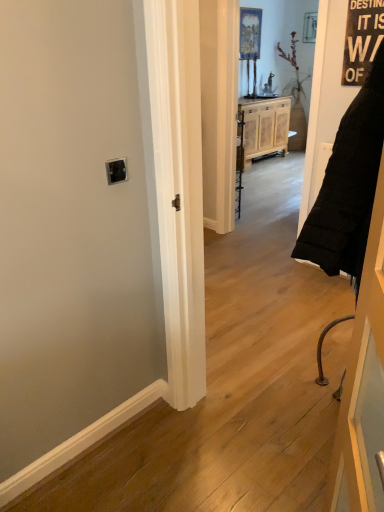
Identify the location of light brown wood cabinet at center. (265, 126).

The image size is (384, 512). Describe the element at coordinates (265, 126) in the screenshot. I see `light brown wood cabinet at center` at that location.

Describe the element at coordinates (363, 386) in the screenshot. I see `black fabric door at right` at that location.

This screenshot has height=512, width=384. I want to click on black fabric door at right, so click(363, 386).

In order to face black fabric door at right, should I rotate leftwards or rightwards?

You should rotate right by 23.812 degrees.

In the scene shown: Measure the distance between point (380, 434) and camera.

The depth of point (380, 434) is 1.07 meters.

You are a GUI agent. You are given a task and a screenshot of the screen. Output one action in this format:
    pyautogui.click(x=<x>, y=<y>)
    Task: Click on the light brown wood cabinet at center
    
    Given the screenshot: What is the action you would take?
    click(265, 126)

Can you confirm if black fabric door at right is positioned to the right of light brown wood cabinet at center?

Incorrect, black fabric door at right is not on the right side of light brown wood cabinet at center.

Is black fabric door at right in front of or behind light brown wood cabinet at center in the image?

Visually, black fabric door at right is located in front of light brown wood cabinet at center.

Is point (354, 406) positioned after point (271, 140)?

No, (354, 406) is closer to viewer.

From the image's perspective, which one is positioned lower, black fabric door at right or light brown wood cabinet at center?

black fabric door at right, from the image's perspective.

From a real-world perspective, which object rests below the other?

From a 3D spatial view, light brown wood cabinet at center is below.

Looking at their sizes, would you say black fabric door at right is wider or thinner than light brown wood cabinet at center?

Considering their sizes, black fabric door at right looks slimmer than light brown wood cabinet at center.

Considering the sizes of black fabric door at right and light brown wood cabinet at center in the image, is black fabric door at right taller or shorter than light brown wood cabinet at center?

black fabric door at right is taller than light brown wood cabinet at center.

Does black fabric door at right have a larger size compared to light brown wood cabinet at center?

No.

Which is correct: black fabric door at right is inside light brown wood cabinet at center, or outside of it?

black fabric door at right lies outside light brown wood cabinet at center.

Is the surface of black fabric door at right in direct contact with light brown wood cabinet at center?

They are not placed beside each other.

Is black fabric door at right looking in the opposite direction of light brown wood cabinet at center?

No.

Consider the image. How many degrees apart are the facing directions of black fabric door at right and light brown wood cabinet at center?

The angular difference between black fabric door at right and light brown wood cabinet at center is 118 degrees.

From the picture: How far apart are black fabric door at right and light brown wood cabinet at center?

They are 5.46 meters apart.

The width and height of the screenshot is (384, 512). Find the location of `door located below the light brown wood cabinet at center (from the image's perspective)`. door located below the light brown wood cabinet at center (from the image's perspective) is located at coordinates (363, 386).

In the scene shown: Is light brown wood cabinet at center to the right of black fabric door at right from the viewer's perspective?

Yes, light brown wood cabinet at center is to the right of black fabric door at right.

Is the depth of light brown wood cabinet at center less than that of black fabric door at right?

No, light brown wood cabinet at center is behind black fabric door at right.

Does point (261, 114) appear closer or farther from the camera than point (366, 296)?

Clearly, point (261, 114) is more distant from the camera than point (366, 296).

From the image's perspective, relative to black fabric door at right, is light brown wood cabinet at center above or below?

Clearly, from the image's perspective, light brown wood cabinet at center is above black fabric door at right.

From a real-world perspective, is light brown wood cabinet at center physically located above or below black fabric door at right?

From a real-world perspective, light brown wood cabinet at center is physically below black fabric door at right.

In the scene shown: Considering the relative sizes of light brown wood cabinet at center and black fabric door at right in the image provided, is light brown wood cabinet at center wider than black fabric door at right?

Yes, light brown wood cabinet at center is wider than black fabric door at right.

From their relative heights in the image, would you say light brown wood cabinet at center is taller or shorter than black fabric door at right?

In the image, light brown wood cabinet at center appears to be shorter than black fabric door at right.

Between light brown wood cabinet at center and black fabric door at right, which one has smaller size?

With smaller size is black fabric door at right.

Looking at this image, can black fabric door at right be found inside light brown wood cabinet at center?

Actually, black fabric door at right is outside light brown wood cabinet at center.

Is light brown wood cabinet at center placed right next to black fabric door at right?

No, light brown wood cabinet at center is not making contact with black fabric door at right.

Is light brown wood cabinet at center turned away from black fabric door at right?

No, black fabric door at right is not at the back of light brown wood cabinet at center.

In the image, there is a light brown wood cabinet at center. What are the coordinates of `door below it (from the image's perspective)` in the screenshot? It's located at [x=363, y=386].

This screenshot has height=512, width=384. What are the coordinates of `cabinetry that is behind the black fabric door at right` in the screenshot? It's located at (265, 126).

Find the location of a particular element. door that appears below the light brown wood cabinet at center (from the image's perspective) is located at coordinates (363, 386).